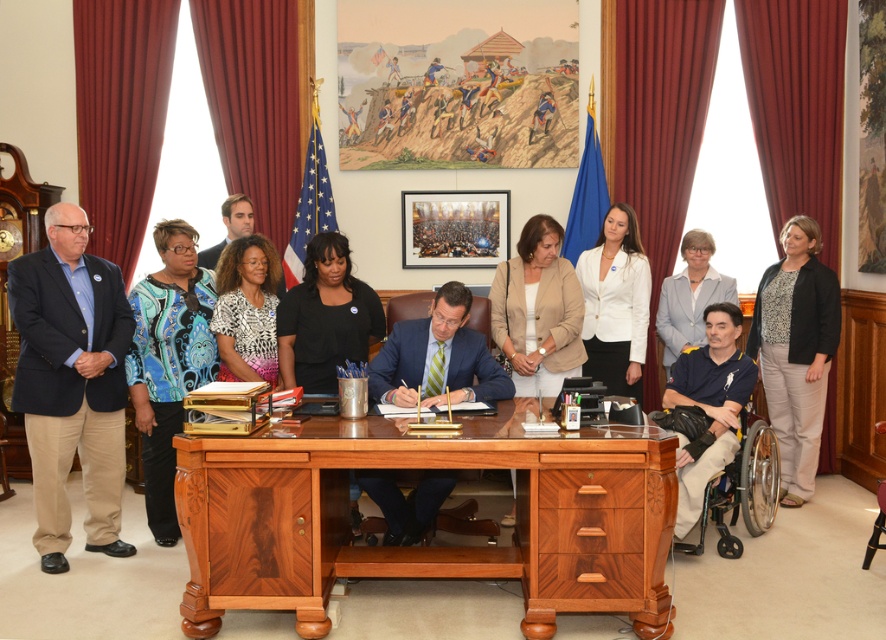
You are organizing a photoshoot and need to arrange two outfits for a catalog. The outfits are the blue patterned blouse at left and the black textured blazer at right. Which outfit takes up less space when displayed?

The blue patterned blouse at left takes up less space than the black textured blazer at right because it is smaller in size.

You are standing at the entrance of the room and want to approach the walnut wood desk at center and the matte black shirt at center. Which object will you encounter first as you move forward?

The walnut wood desk at center is closer to the viewer than the matte black shirt at center, so you will encounter the walnut wood desk at center first as you move forward.